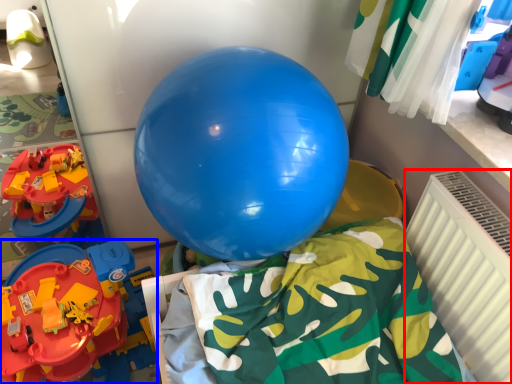
Question: Which of the following is the farthest to the observer, radiator (highlighted by a red box) or toy (highlighted by a blue box)?

Choices:
 (A) radiator
 (B) toy

Answer: (B)